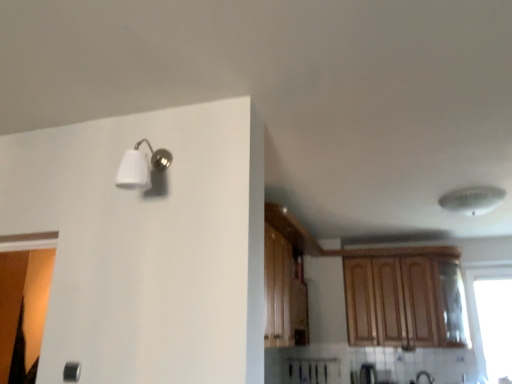
Question: Does transparent glass window at right lie behind white plastic ceiling fan at upper right?

Choices:
 (A) yes
 (B) no

Answer: (A)

Question: From the image's perspective, is transparent glass window at right over white plastic ceiling fan at upper right?

Choices:
 (A) yes
 (B) no

Answer: (B)

Question: Can you confirm if transparent glass window at right is positioned to the left of white plastic ceiling fan at upper right?

Choices:
 (A) no
 (B) yes

Answer: (A)

Question: From a real-world perspective, does transparent glass window at right stand above white plastic ceiling fan at upper right?

Choices:
 (A) no
 (B) yes

Answer: (A)

Question: Would you say transparent glass window at right is a long distance from white plastic ceiling fan at upper right?

Choices:
 (A) yes
 (B) no

Answer: (A)

Question: Can you confirm if transparent glass window at right is positioned to the right of white plastic ceiling fan at upper right?

Choices:
 (A) yes
 (B) no

Answer: (A)

Question: Is white matte light fixture at upper left shorter than wooden cabinet at upper right?

Choices:
 (A) yes
 (B) no

Answer: (A)

Question: Can you confirm if white matte light fixture at upper left is positioned to the left of wooden cabinet at upper right?

Choices:
 (A) yes
 (B) no

Answer: (A)

Question: Is white matte light fixture at upper left oriented towards wooden cabinet at upper right?

Choices:
 (A) no
 (B) yes

Answer: (A)

Question: Is white matte light fixture at upper left turned away from wooden cabinet at upper right?

Choices:
 (A) no
 (B) yes

Answer: (A)

Question: From a real-world perspective, is white matte light fixture at upper left below wooden cabinet at upper right?

Choices:
 (A) yes
 (B) no

Answer: (B)

Question: Does white matte light fixture at upper left have a greater height compared to wooden cabinet at upper right?

Choices:
 (A) no
 (B) yes

Answer: (A)

Question: Does white plastic ceiling fan at upper right appear on the right side of white matte light fixture at upper left?

Choices:
 (A) no
 (B) yes

Answer: (B)